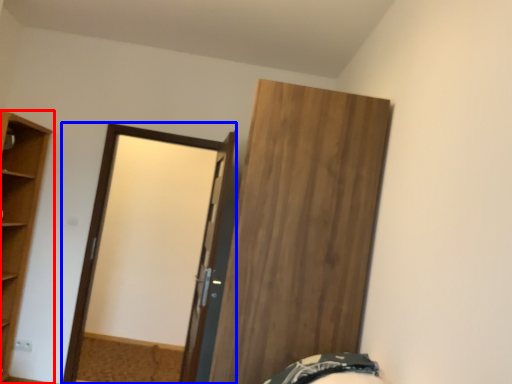
Question: Which point is further to the camera, cupboard (highlighted by a red box) or screen door (highlighted by a blue box)?

Choices:
 (A) cupboard
 (B) screen door

Answer: (B)